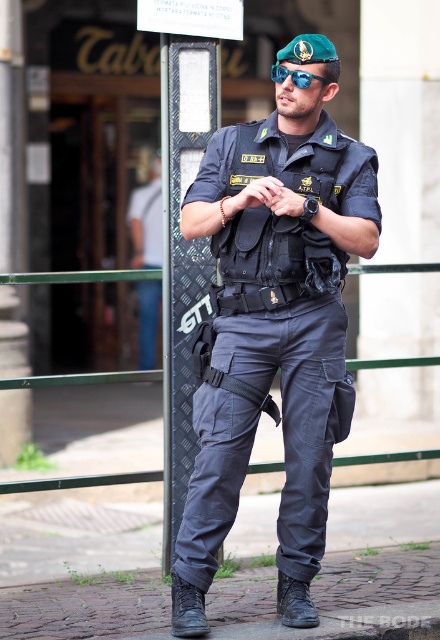
You are given an image of a person standing outdoors near a metal pole with a sign. The person is wearing a uniform. Where is the matte black uniform at center located in the image?

The matte black uniform at center is located at point (x=275, y=324) in the image.

You are a security officer assigned to monitor the entrance of the building. You notice a specific point marked at coordinates [275,324] in the image. What object is located at this point?

The matte black uniform at center is located at point [275,324].

You are an observer trying to determine the relative sizes of objects in the scene. Given that you see the matte black uniform at center and the blue reflective lens goggles at center, which object is smaller?

The matte black uniform at center is smaller than the blue reflective lens goggles at center according to the description.